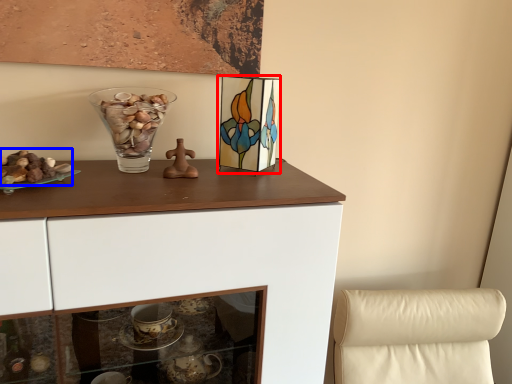
Question: Which object appears closest to the camera in this image, picture frame (highlighted by a red box) or stuff (highlighted by a blue box)?

Choices:
 (A) picture frame
 (B) stuff

Answer: (B)